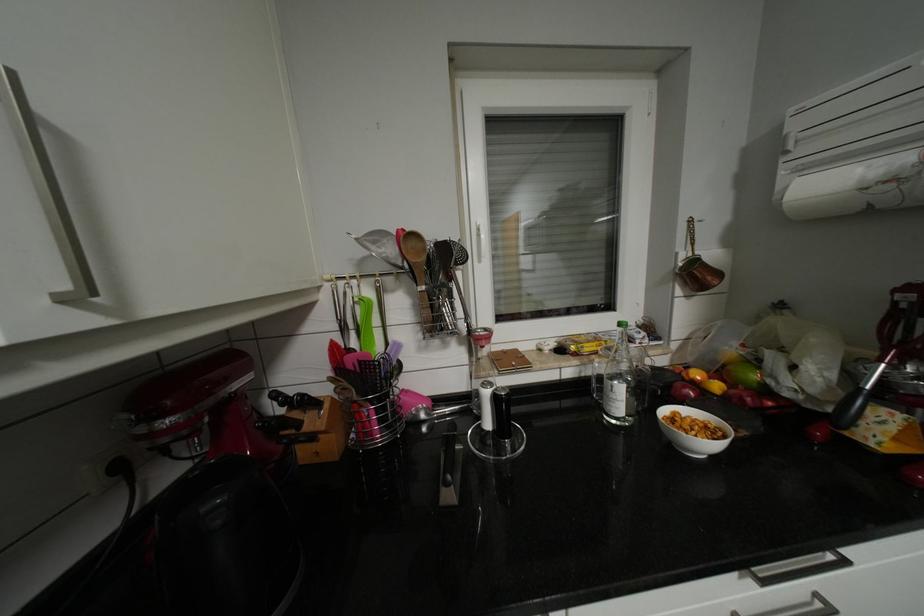
The location [418,270] corresponds to which object?

It corresponds to the wooden spoon in the image.